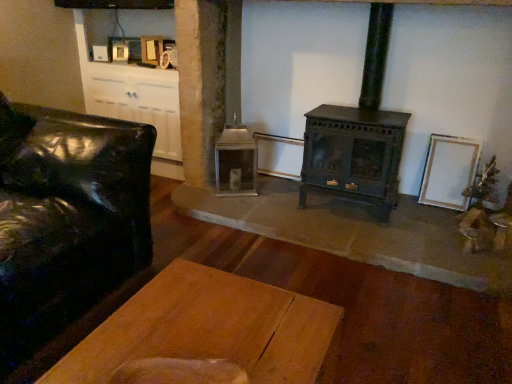
At what (x,y) coordinates should I click in order to perform the action: click on free point above wooden plank table at center (from a real-world perspective). Please return your answer as a coordinate pair (x, y). Image resolution: width=512 pixels, height=384 pixels. Looking at the image, I should click on (213, 326).